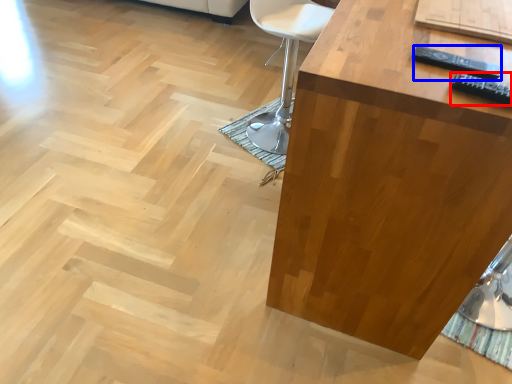
Question: Which object appears closest to the camera in this image, remote (highlighted by a red box) or remote (highlighted by a blue box)?

Choices:
 (A) remote
 (B) remote

Answer: (A)